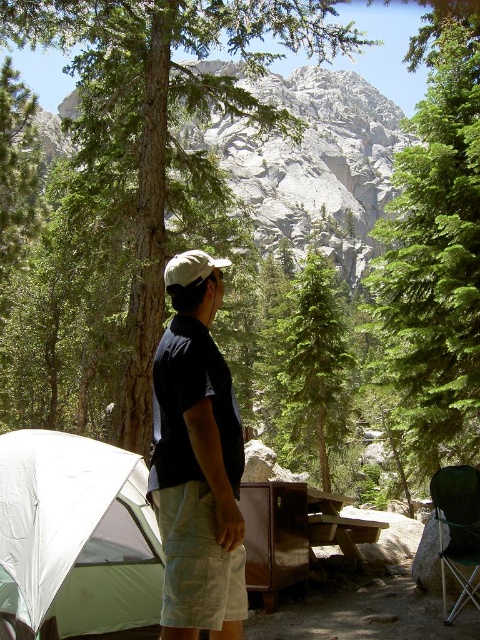
You are a hiker who has just arrived at the campsite. You need to set up your tent. Where exactly should you place your tent so that it is as close as possible to the metallic folding chair at lower right?

The metallic folding chair at lower right is located at point [457,531]. To place the tent as close as possible to it, set up the tent near that coordinate.